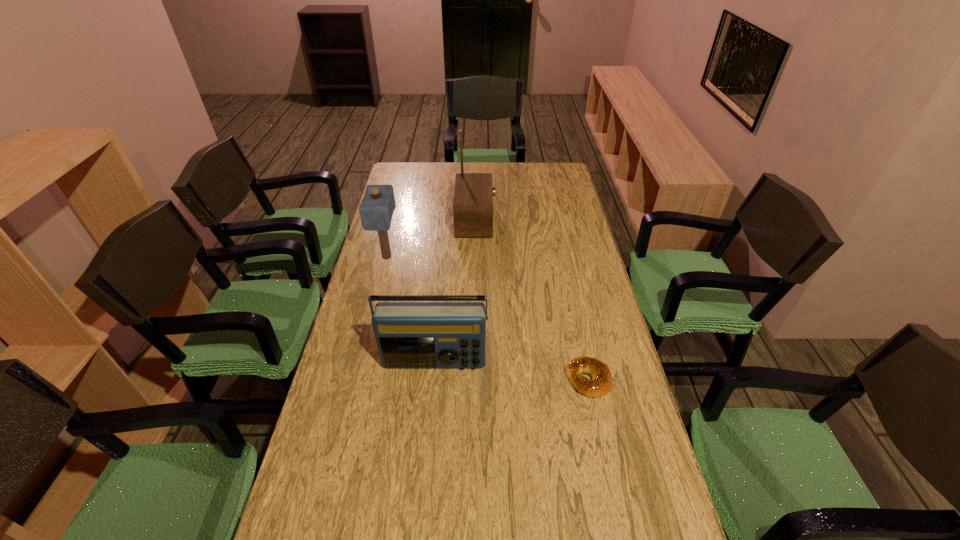
Find the location of a particular element. object that stands as the third closest to the bagel is located at coordinates (376, 209).

Where is `object that stands as the second closest to the rightmost object`? This screenshot has height=540, width=960. object that stands as the second closest to the rightmost object is located at coordinates (473, 197).

Locate an element on the screen. The image size is (960, 540). vacant region that satisfies the following two spatial constraints: 1. on the back side of the bagel; 2. on the front-facing side of the farthest object is located at coordinates (554, 220).

You are a GUI agent. You are given a task and a screenshot of the screen. Output one action in this format:
    pyautogui.click(x=<x>, y=<y>)
    Task: Click on the vacant area in the image that satisfies the following two spatial constraints: 1. on the front panel of the rightmost object; 2. on the right side of the shorter radio receiver
    The height and width of the screenshot is (540, 960).
    Given the screenshot: What is the action you would take?
    pyautogui.click(x=433, y=379)